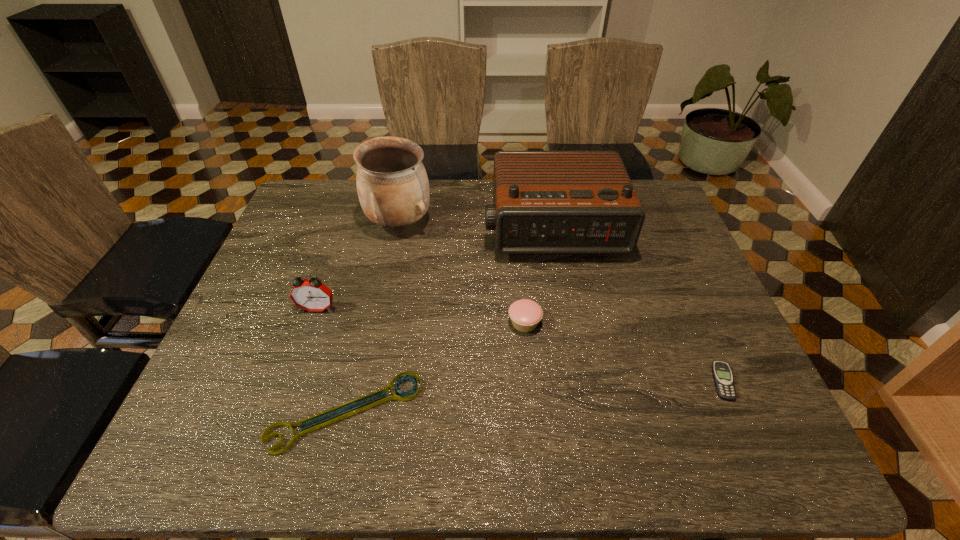
Identify the location of vacant space located 0.390m on the left of the beeper. (535, 382).

You are a GUI agent. You are given a task and a screenshot of the screen. Output one action in this format:
    pyautogui.click(x=<x>, y=<y>)
    Task: Click on the free space located on the right of the wrench
    The width and height of the screenshot is (960, 540).
    Given the screenshot: What is the action you would take?
    pyautogui.click(x=444, y=412)

Find the location of `urn at the far edge`. urn at the far edge is located at coordinates (392, 184).

Where is `radio receiver that is at the far edge`? This screenshot has height=540, width=960. radio receiver that is at the far edge is located at coordinates (545, 202).

You are a GUI agent. You are given a task and a screenshot of the screen. Output one action in this format:
    pyautogui.click(x=<x>, y=<y>)
    Task: Click on the object that is at the near edge
    Image resolution: width=960 pixels, height=540 pixels.
    Given the screenshot: What is the action you would take?
    pyautogui.click(x=409, y=395)

The image size is (960, 540). Identify the location of object located at the left edge. (312, 295).

Where is `object positioned at the right edge`? object positioned at the right edge is located at coordinates (722, 375).

Find the location of a particular element. The width and height of the screenshot is (960, 540). vacant region at the far edge of the desktop is located at coordinates (352, 205).

In the image, there is a desktop. Identify the location of vacant area at the near edge. Image resolution: width=960 pixels, height=540 pixels. (685, 460).

I want to click on blank area at the left edge, so click(x=228, y=379).